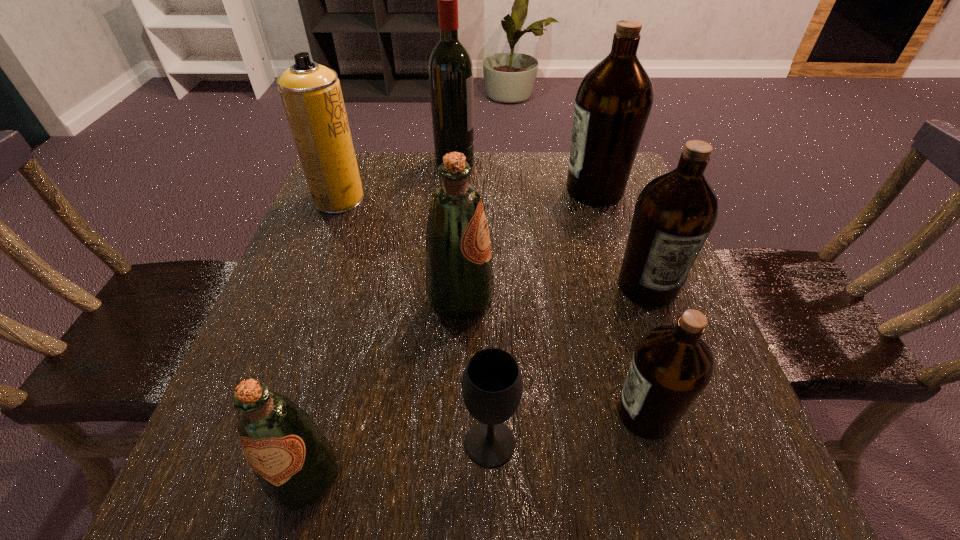
The image size is (960, 540). What are the coordinates of `wine bottle` in the screenshot? It's located at (450, 66).

Locate an element on the screen. the tallest olive oil is located at coordinates (613, 102).

Where is `the farthest olive oil`? the farthest olive oil is located at coordinates (613, 102).

Find the location of a particular element. aerosol can is located at coordinates (311, 94).

You are a GUI agent. You are given a task and a screenshot of the screen. Output one action in this format:
    pyautogui.click(x=<x>, y=<y>)
    Task: Click on the farther green olive oil
    
    Given the screenshot: What is the action you would take?
    pyautogui.click(x=459, y=275)

What are the coordinates of `the right green olive oil` in the screenshot? It's located at (459, 275).

This screenshot has width=960, height=540. I want to click on the second farthest brown olive oil, so click(674, 214).

Where is `the smallest brown olive oil`? This screenshot has height=540, width=960. the smallest brown olive oil is located at coordinates (671, 366).

Where is `the nearer green olive oil`? This screenshot has width=960, height=540. the nearer green olive oil is located at coordinates (294, 462).

Locate an element on the screen. the left green olive oil is located at coordinates (294, 462).